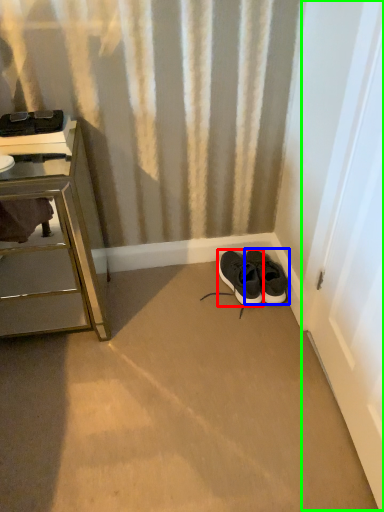
Question: Which object is the farthest from shoe (highlighted by a red box)? Choose among these: footwear (highlighted by a blue box) or screen door (highlighted by a green box).

Choices:
 (A) footwear
 (B) screen door

Answer: (B)